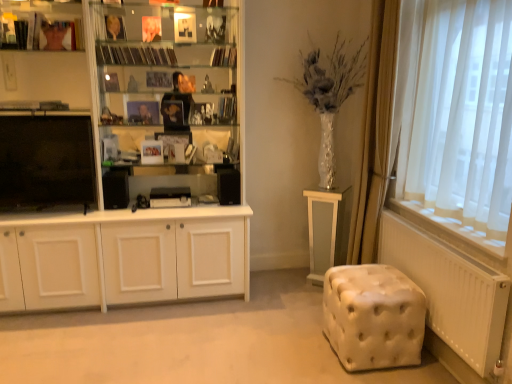
What are the coordinates of `vacant space situated above black matte bookshelf at upper center, the third book when ordered from right to left (from a real-world perspective)` in the screenshot? It's located at (131, 40).